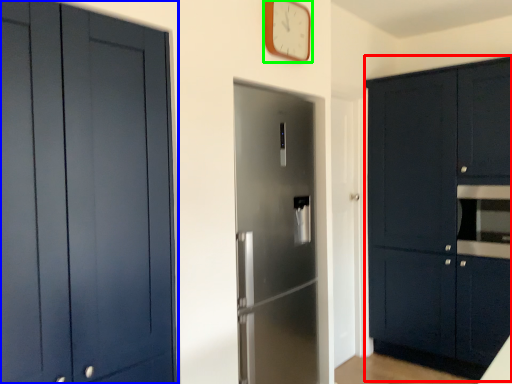
Question: Based on their relative distances, which object is farther from cabinetry (highlighted by a red box)? Choose from cabinetry (highlighted by a blue box) and clock (highlighted by a green box).

Choices:
 (A) cabinetry
 (B) clock

Answer: (A)